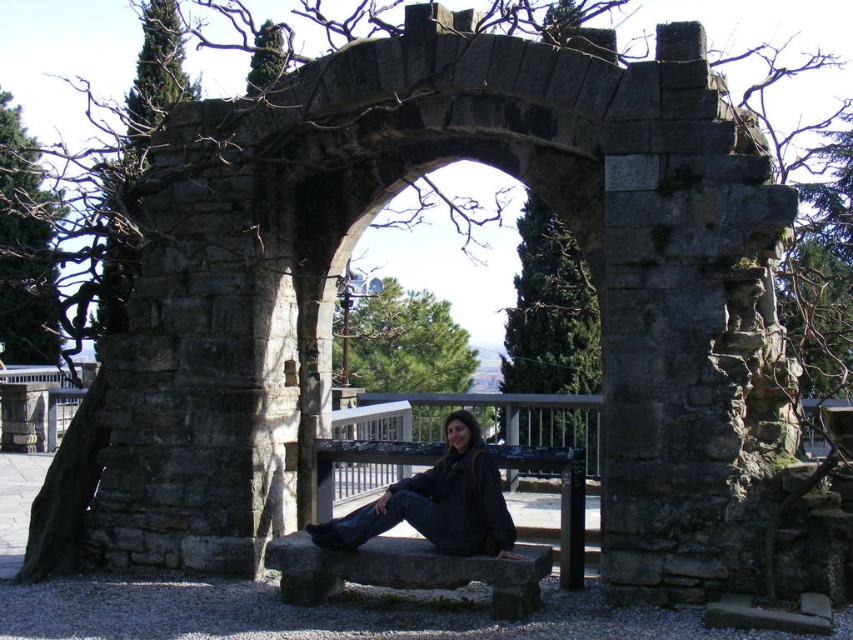
You are standing at the entrance of the archway and want to sit down. Where exactly is the gray stone bench at center located in relation to the archway?

The gray stone bench at center is located at point 0.892 on the x axis and 0.477 on the y axis relative to the archway.